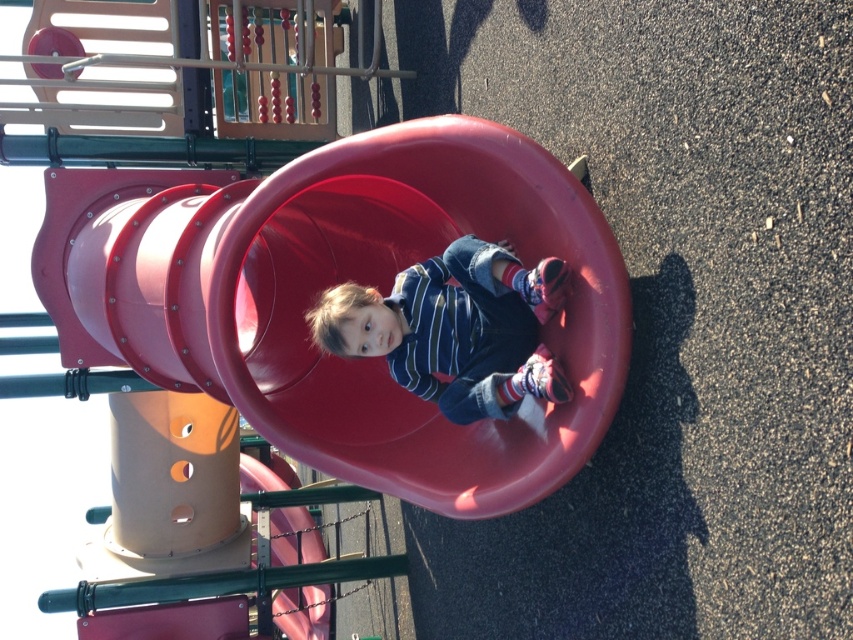
Can you confirm if smooth plastic slide at center is smaller than striped cotton shirt at center?

No, smooth plastic slide at center is not smaller than striped cotton shirt at center.

In the scene shown: Measure the distance between smooth plastic slide at center and striped cotton shirt at center.

smooth plastic slide at center is 17.29 inches from striped cotton shirt at center.

Is point (498, 136) positioned after point (514, 330)?

No, (498, 136) is in front of (514, 330).

Locate an element on the screen. This screenshot has height=640, width=853. smooth plastic slide at center is located at coordinates (486, 237).